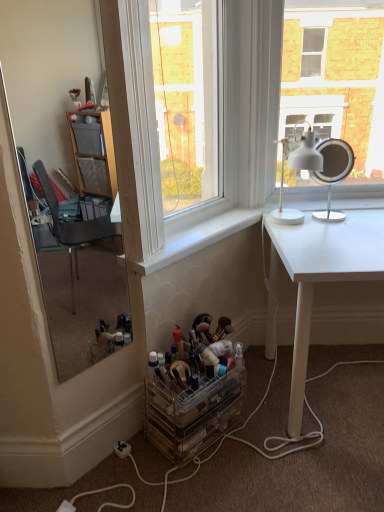
What are the coordinates of `vacant space to the right of white plastic power outlet at lower center` in the screenshot? It's located at (157, 460).